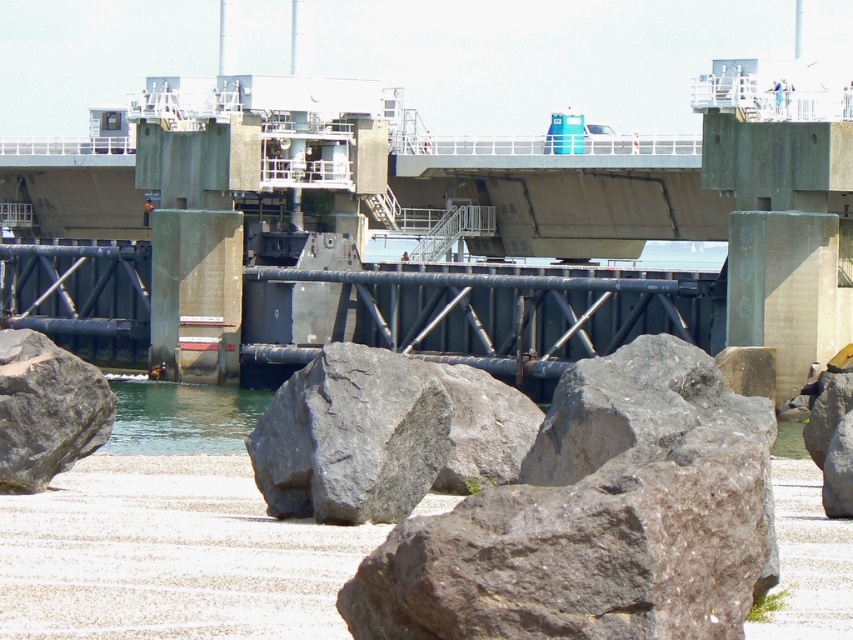
Question: Which is farther from the gray rough rock at center?

Choices:
 (A) gray rough rock at lower left
 (B) gray rough stone at center
 (C) clear water at lower center

Answer: (C)

Question: Which object appears closest to the camera in this image?

Choices:
 (A) gray rough rock at center
 (B) gray rough rock at lower left
 (C) clear water at lower center
 (D) gray rough stone at center

Answer: (D)

Question: Does gray rough stone at center appear under gray rough rock at lower left?

Choices:
 (A) no
 (B) yes

Answer: (B)

Question: Does gray rough stone at center appear over gray rough rock at lower left?

Choices:
 (A) no
 (B) yes

Answer: (A)

Question: Is clear water at lower center above gray rough rock at center?

Choices:
 (A) no
 (B) yes

Answer: (A)

Question: Which of the following is the closest to the observer?

Choices:
 (A) [x=340, y=358]
 (B) [x=180, y=388]
 (C) [x=20, y=332]
 (D) [x=508, y=392]

Answer: (A)